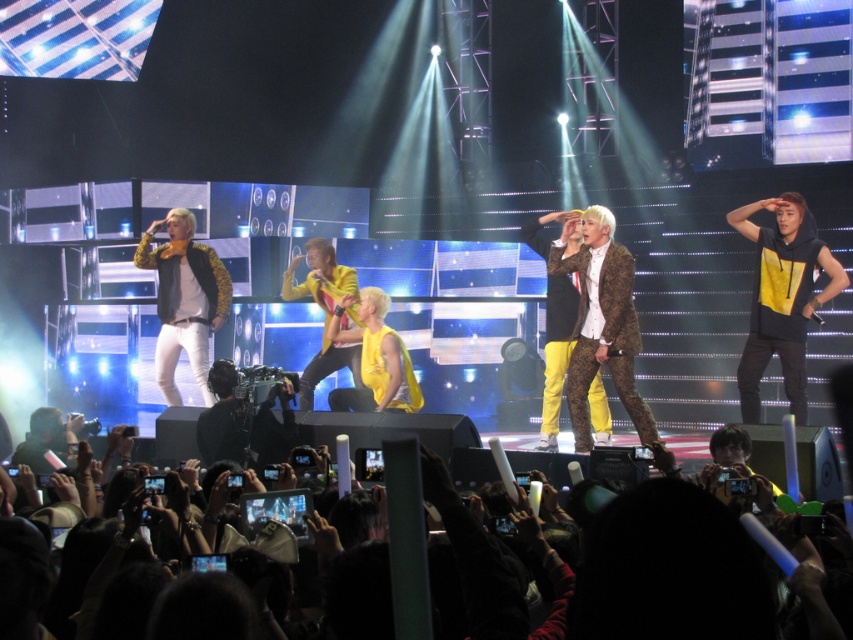
Question: Which of the following is the closest to the observer?

Choices:
 (A) yellow matte hoodie at right
 (B) black fabric crowd at lower center

Answer: (B)

Question: Which of the following is the closest to the observer?

Choices:
 (A) (184, 262)
 (B) (750, 412)

Answer: (B)

Question: Does yellow matte hoodie at right have a greater width compared to leopard print jacket at left?

Choices:
 (A) yes
 (B) no

Answer: (B)

Question: Is black fabric crowd at lower center below leopard print jacket at left?

Choices:
 (A) yes
 (B) no

Answer: (A)

Question: Does yellow matte hoodie at right appear over leopard print jacket at left?

Choices:
 (A) no
 (B) yes

Answer: (A)

Question: Which point is farther from the camera taking this photo?

Choices:
 (A) (642, 570)
 (B) (747, 353)

Answer: (B)